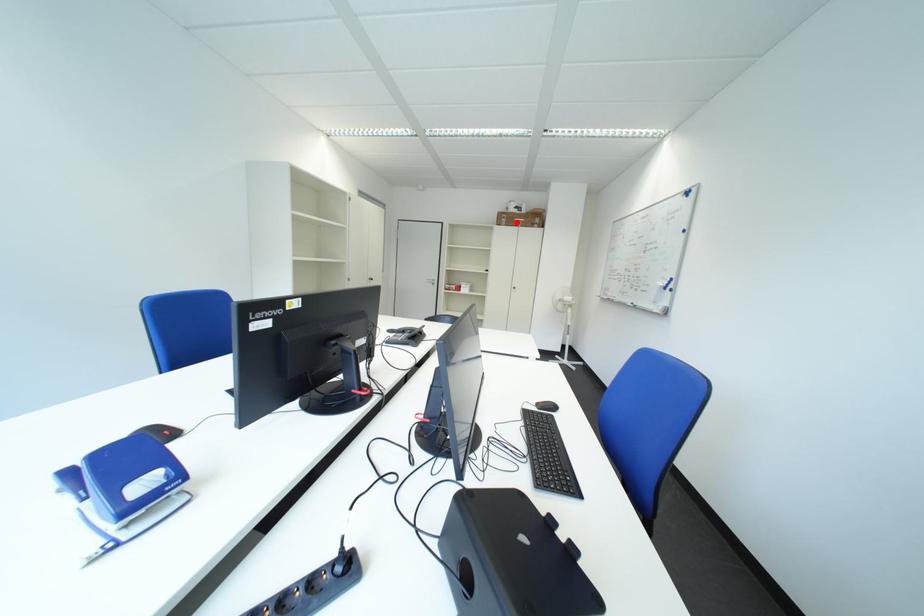
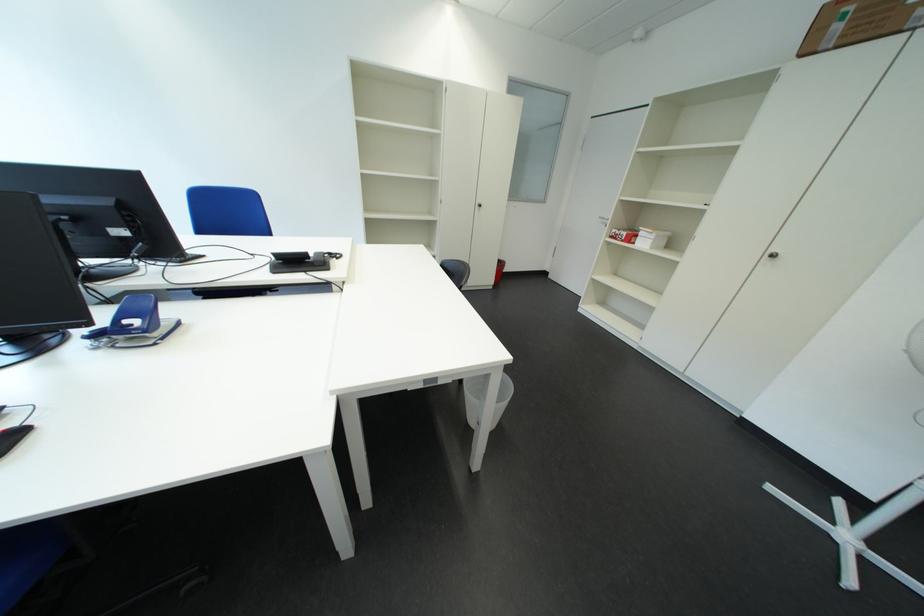
Question: I am providing you with two images of the same scene from different viewpoints. A red point is shown in image1. For the corresponding object point in image2, is it positioned nearer or farther from the camera?

Choices:
 (A) Nearer
 (B) Farther

Answer: (B)